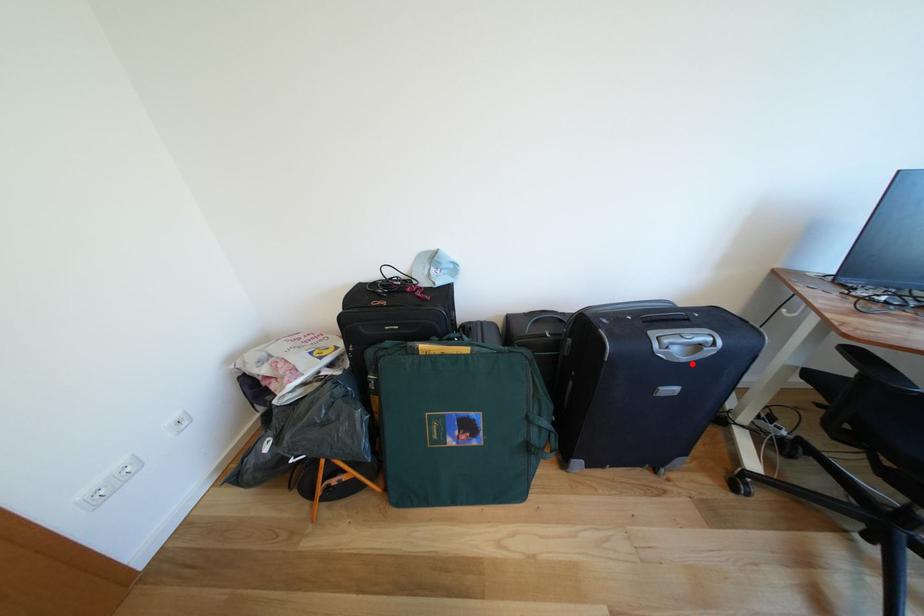
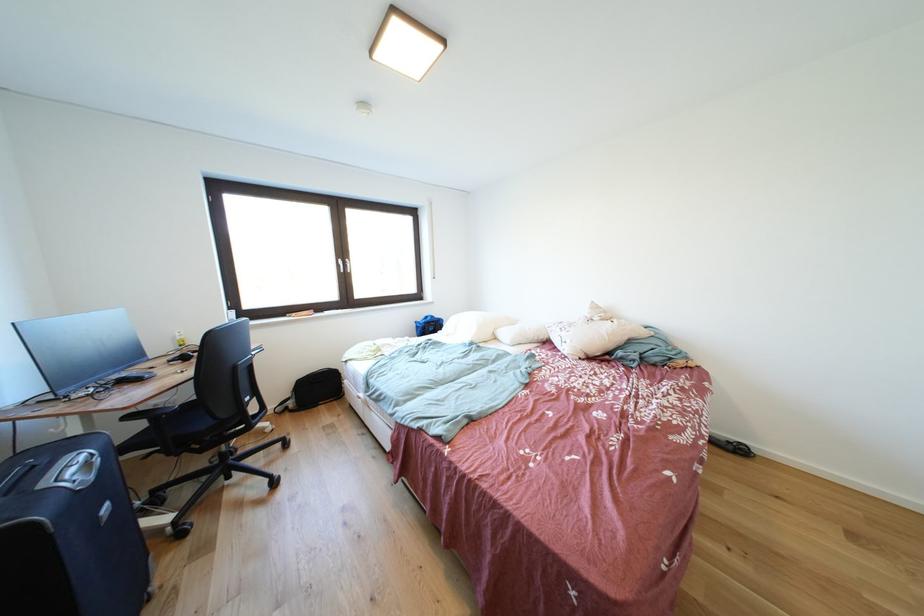
Question: I am providing you with two images of the same scene from different viewpoints. A red point is marked on the first image. At the location where the point appears in image 1, is it still visible in image 2?

Choices:
 (A) Yes
 (B) No

Answer: (A)